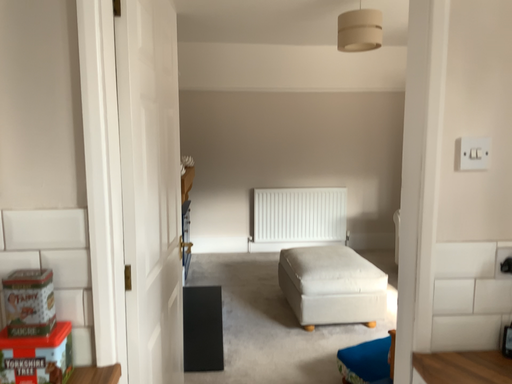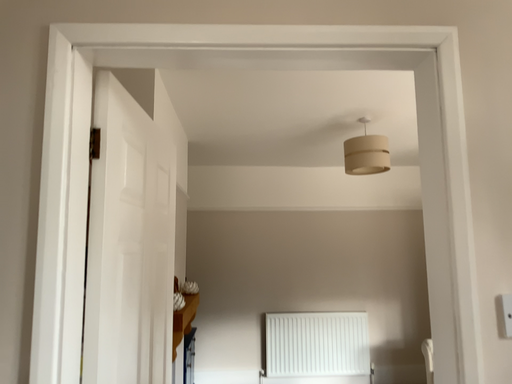
Question: Which way did the camera rotate in the video?

Choices:
 (A) rotated downward
 (B) rotated upward

Answer: (B)